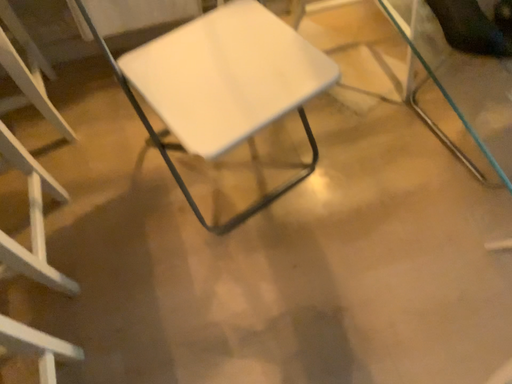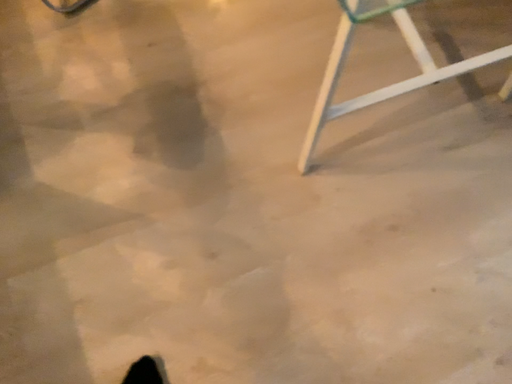
Question: Which way did the camera rotate in the video?

Choices:
 (A) rotated upward
 (B) rotated downward

Answer: (B)